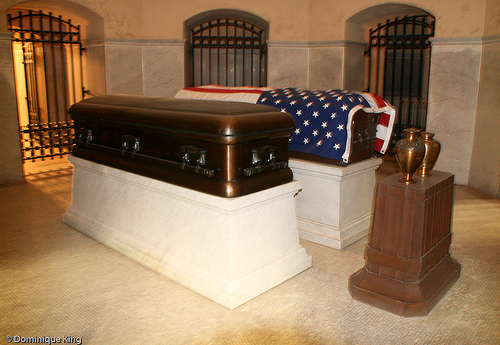
Locate an element on the screen. copper urn is located at coordinates (407, 148).